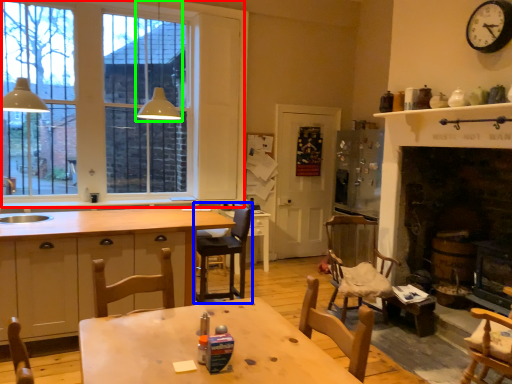
Question: Which object is positioned farthest from window (highlighted by a red box)? Select from chair (highlighted by a blue box) and light fixture (highlighted by a green box).

Choices:
 (A) chair
 (B) light fixture

Answer: (A)